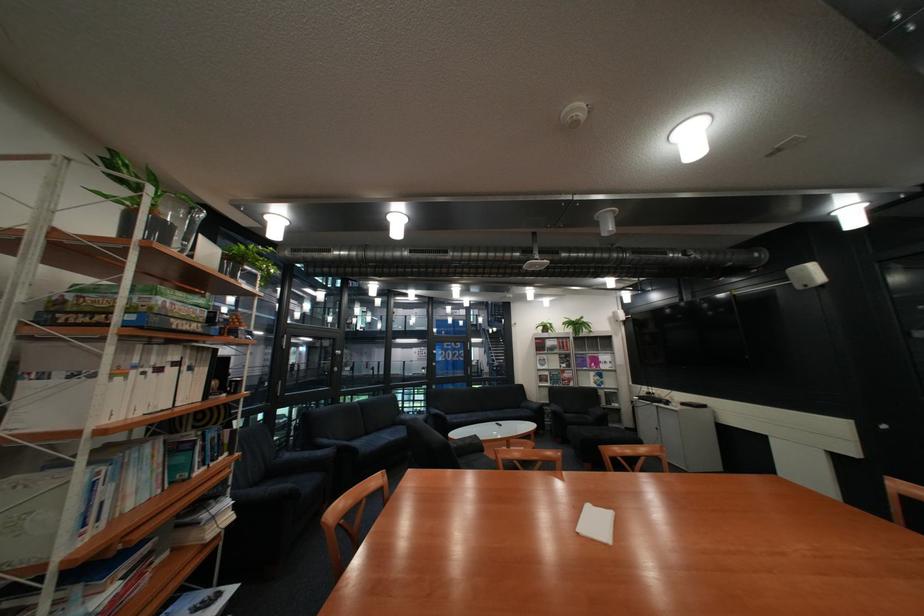
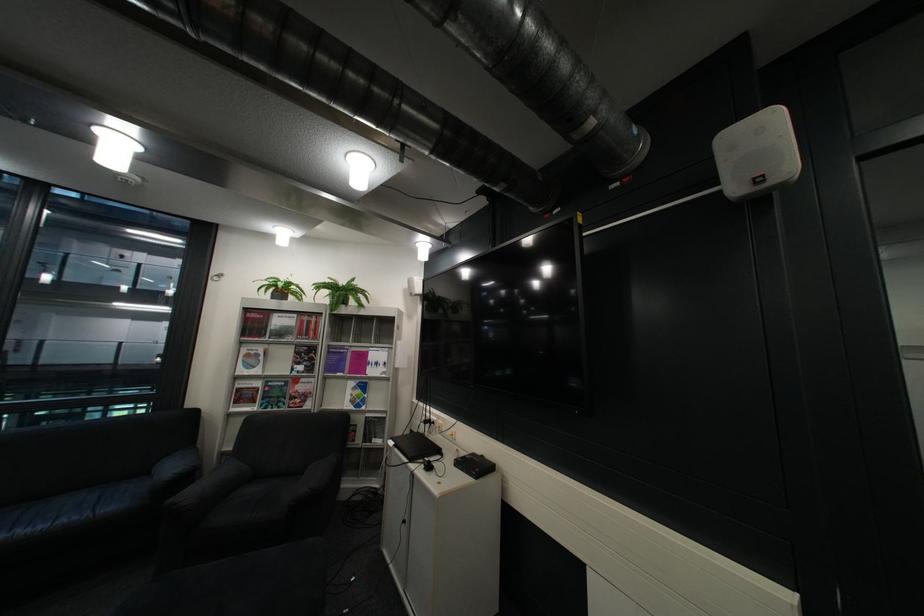
In the second image, find the point that corresponds to (630,405) in the first image.

(393, 442)